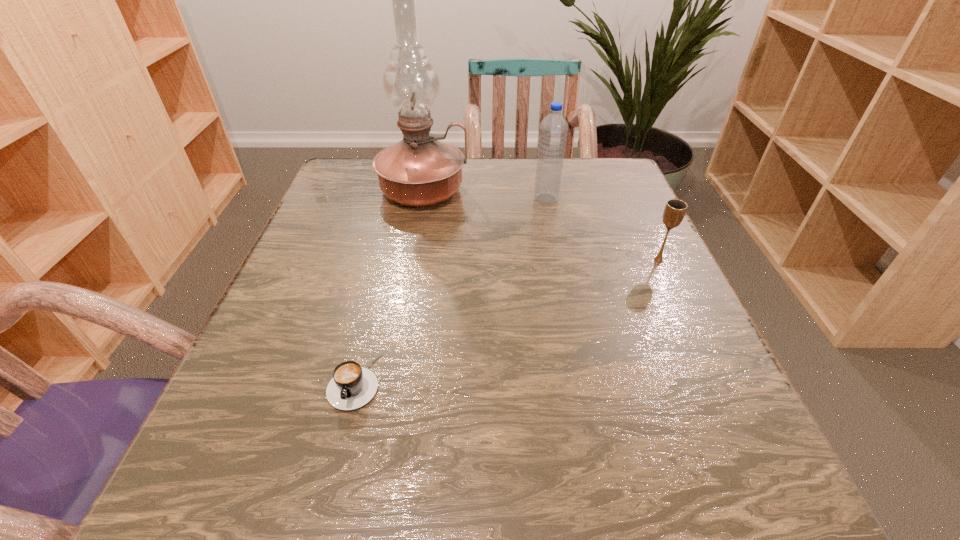
Locate an element on the screen. The width and height of the screenshot is (960, 540). oil lamp is located at coordinates (419, 170).

The height and width of the screenshot is (540, 960). I want to click on water bottle, so click(x=553, y=132).

This screenshot has width=960, height=540. I want to click on the third shortest object, so click(553, 132).

The height and width of the screenshot is (540, 960). Identify the location of the third farthest object. (675, 209).

Image resolution: width=960 pixels, height=540 pixels. Identify the location of chalice. (675, 209).

You are a GUI agent. You are given a task and a screenshot of the screen. Output one action in this format:
    pyautogui.click(x=<x>, y=<y>)
    Task: Click on the nearest object
    Image resolution: width=960 pixels, height=540 pixels.
    Given the screenshot: What is the action you would take?
    pyautogui.click(x=352, y=386)

I want to click on cappuccino, so click(x=352, y=386).

Where is `vacant space situated 0.230m on the front of the tallest object`? The height and width of the screenshot is (540, 960). vacant space situated 0.230m on the front of the tallest object is located at coordinates (405, 288).

Find the location of a particular element. The image size is (960, 540). vacant region located 0.100m on the front of the second tallest object is located at coordinates pos(553,232).

Identify the location of blank space located 0.290m on the back of the chalice. (620, 179).